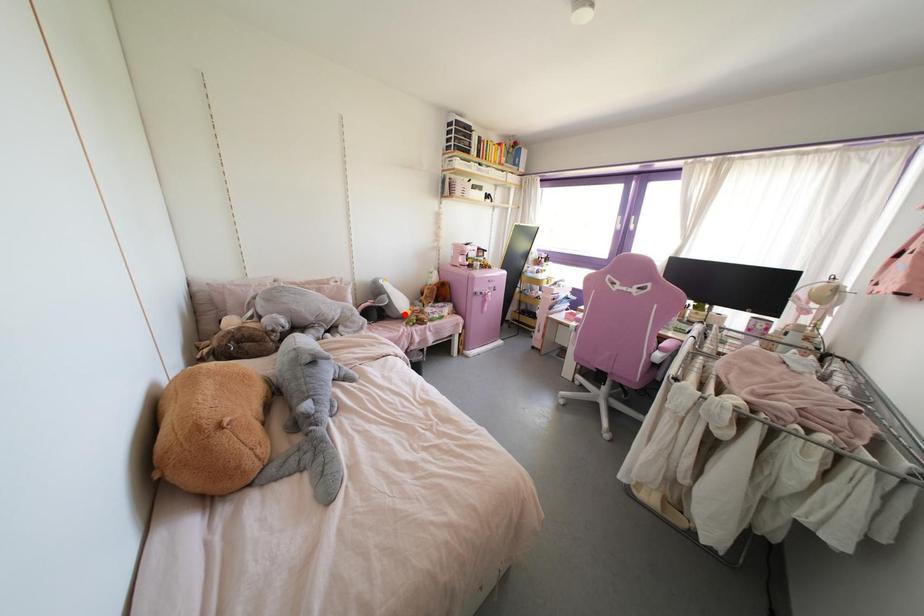
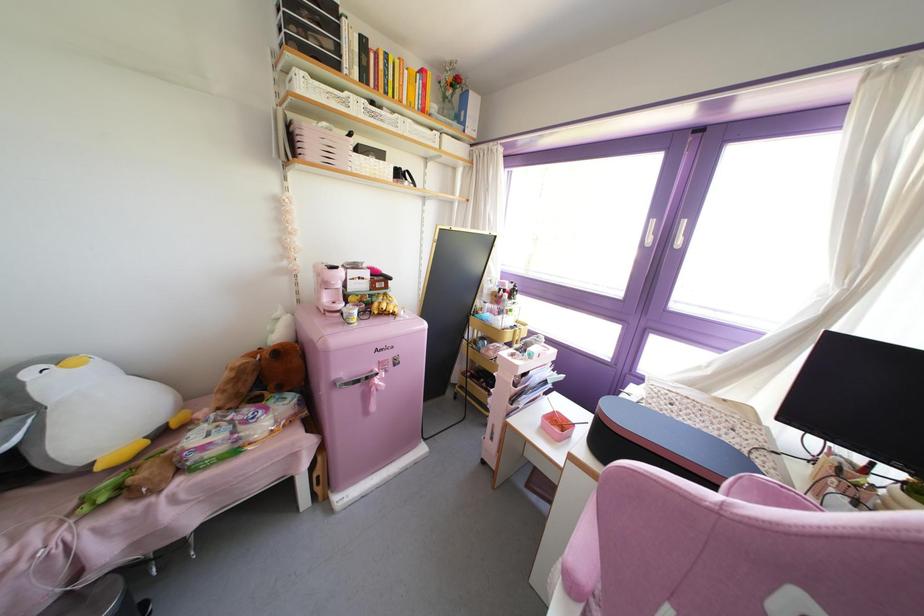
Where in the second image is the point corresponding to the highlighted location from the first image?

(99, 467)